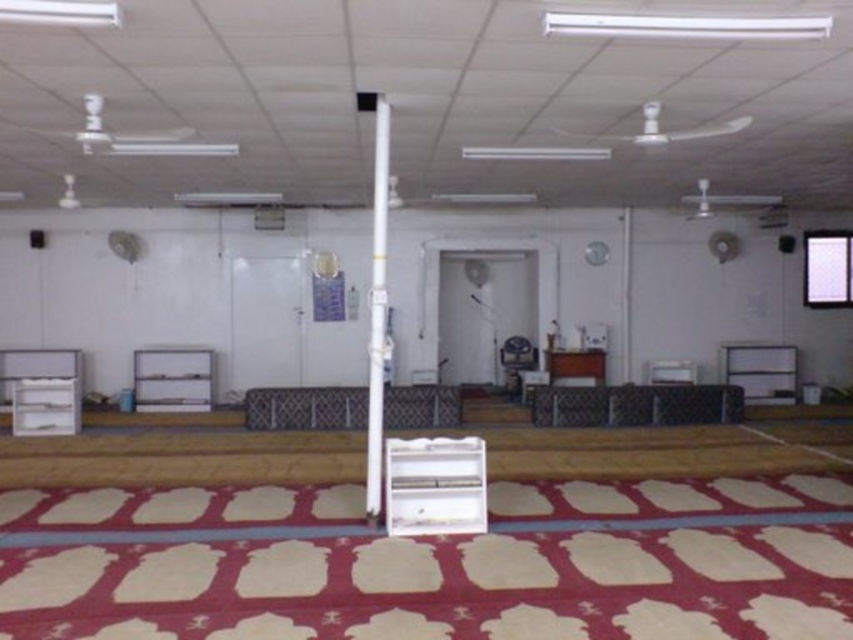
You are a visitor in the mosque and want to sit down. You see the white glossy pole at center and the metallic silver chair at center. Which object is closer to your right side?

The metallic silver chair at center is closer to your right side because the white glossy pole at center is to the left of it.

Consider the image. You are a visitor to the mosque and need to sit down. You see the metallic silver bench at center and the metallic silver chair at center. Which one can accommodate more people at the same time?

The metallic silver bench at center is bigger than the metallic silver chair at center, so it can accommodate more people at the same time.